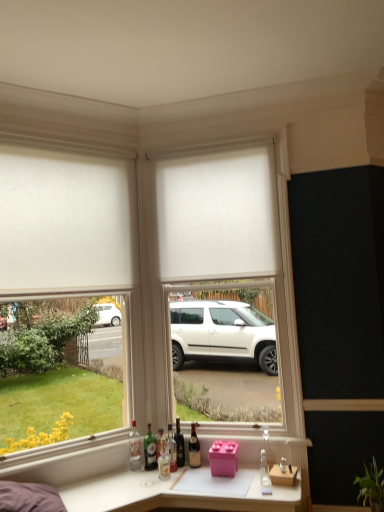
At what (x,y) coordinates should I click in order to perform the action: click on free space that is in between clear glass bottle at lower left, positioned as the seventh bottle in right-to-left order, and clear glass bottle at center, positioned as the seventh bottle in left-to-right order. Please return your answer as a coordinate pair (x, y). This screenshot has width=384, height=512. Looking at the image, I should click on (201, 477).